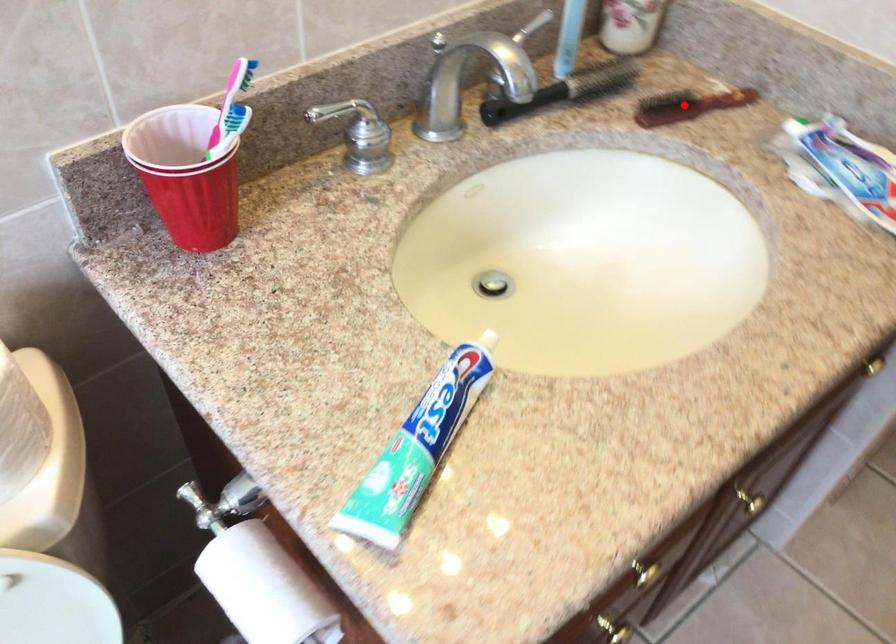
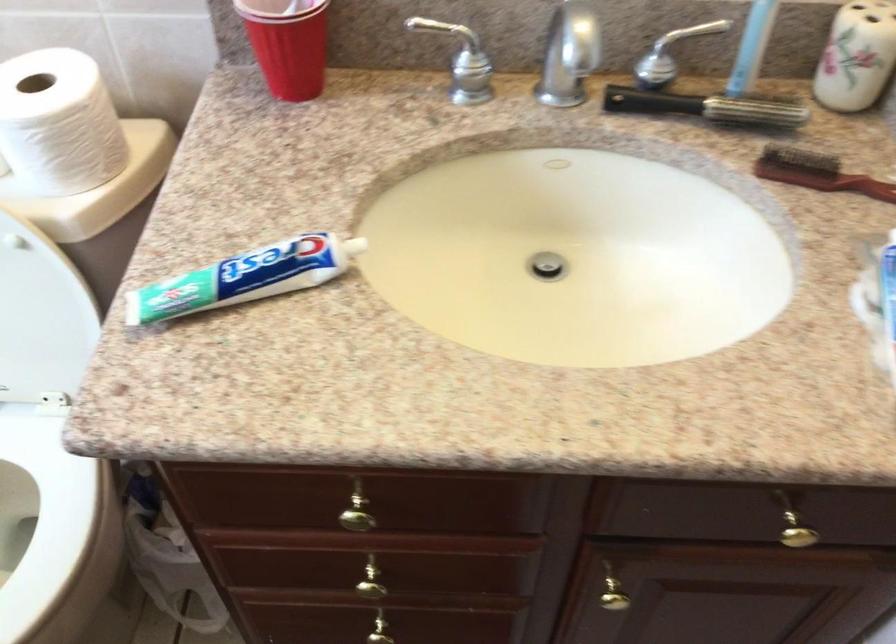
Question: I am providing you with two images of the same scene from different viewpoints. Image1 has a red point marked. In image2, the corresponding 3D location appears at what relative position? Reply with the corresponding letter.

Choices:
 (A) Closer
 (B) Farther

Answer: (A)